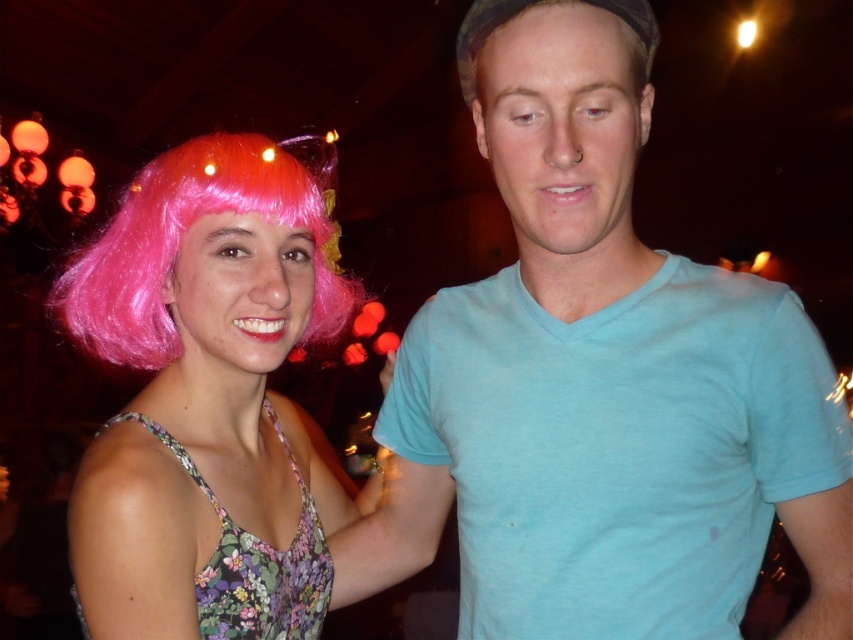
Can you confirm if pink matte wig at left is bigger than floral-patterned fabric dress at lower left?

Yes.

Describe the element at coordinates (183, 236) in the screenshot. The image size is (853, 640). I see `pink matte wig at left` at that location.

This screenshot has width=853, height=640. I want to click on pink matte wig at left, so click(183, 236).

Does floral-patterned fabric dress at lower left have a lesser height compared to brown matte hair at upper center?

No.

Does floral-patterned fabric dress at lower left appear on the left side of brown matte hair at upper center?

Correct, you'll find floral-patterned fabric dress at lower left to the left of brown matte hair at upper center.

The image size is (853, 640). What are the coordinates of `floral-patterned fabric dress at lower left` in the screenshot? It's located at (256, 563).

The image size is (853, 640). Find the location of `floral-patterned fabric dress at lower left`. floral-patterned fabric dress at lower left is located at coordinates (256, 563).

Can you confirm if light blue cotton t-shirt at center is shorter than floral-patterned fabric dress at lower left?

Incorrect, light blue cotton t-shirt at center's height does not fall short of floral-patterned fabric dress at lower left's.

Can you confirm if light blue cotton t-shirt at center is positioned to the right of floral-patterned fabric dress at lower left?

Yes, light blue cotton t-shirt at center is to the right of floral-patterned fabric dress at lower left.

Is point (563, 276) more distant than point (254, 589)?

Yes, it is.

Find the location of a particular element. The image size is (853, 640). light blue cotton t-shirt at center is located at coordinates (595, 378).